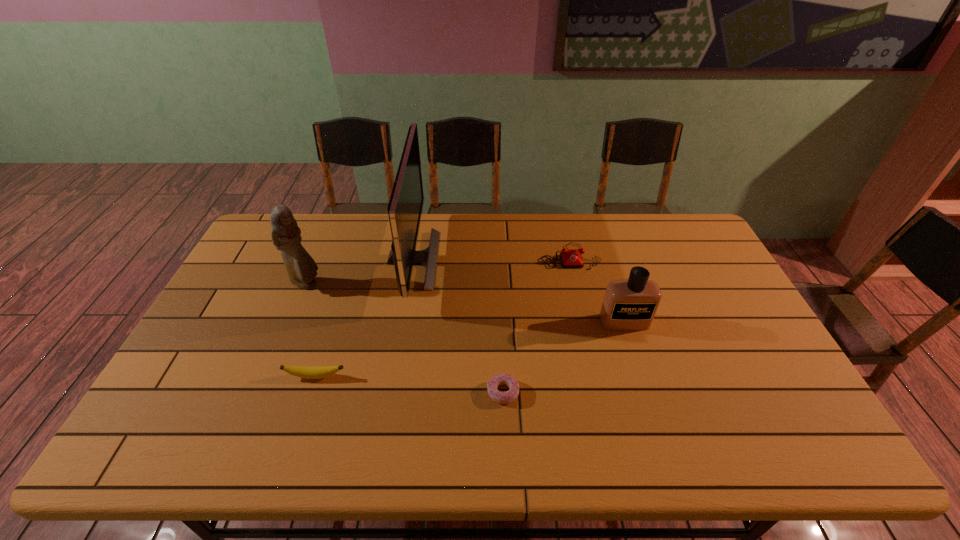
In order to click on vacant area between the tallest object and the perfume in this screenshot , I will do `click(518, 291)`.

Where is `free area in between the telephone and the fourth object from left to right`? free area in between the telephone and the fourth object from left to right is located at coordinates (537, 325).

Find the location of a particular element. The width and height of the screenshot is (960, 540). object that is the second closest to the monitor is located at coordinates (308, 372).

Locate which object is the fifth closest to the fourth object from right to left. Please provide its 2D coordinates. Your answer should be formatted as a tuple, i.e. [(x, y)], where the tuple contains the x and y coordinates of a point satisfying the conditions above.

[(630, 304)]

You are a GUI agent. You are given a task and a screenshot of the screen. Output one action in this format:
    pyautogui.click(x=<x>, y=<y>)
    Task: Click on the vacant point that satisfies the following two spatial constraints: 1. on the front side of the doughnut; 2. on the left side of the fifth tallest object
    The width and height of the screenshot is (960, 540).
    Given the screenshot: What is the action you would take?
    pyautogui.click(x=310, y=392)

In order to click on free space that satisfies the following two spatial constraints: 1. on the front side of the doughnut; 2. on the right side of the second shortest object in this screenshot , I will do `click(310, 392)`.